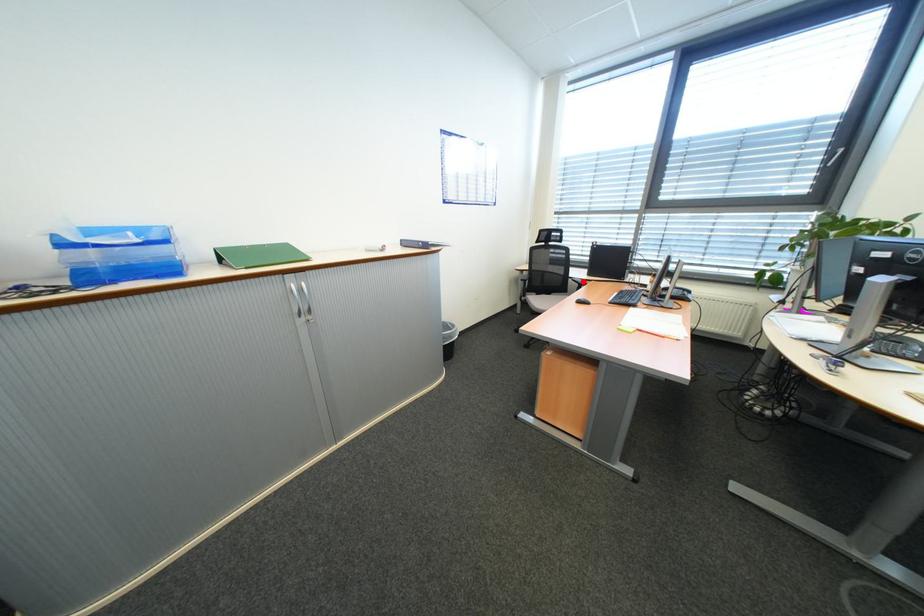
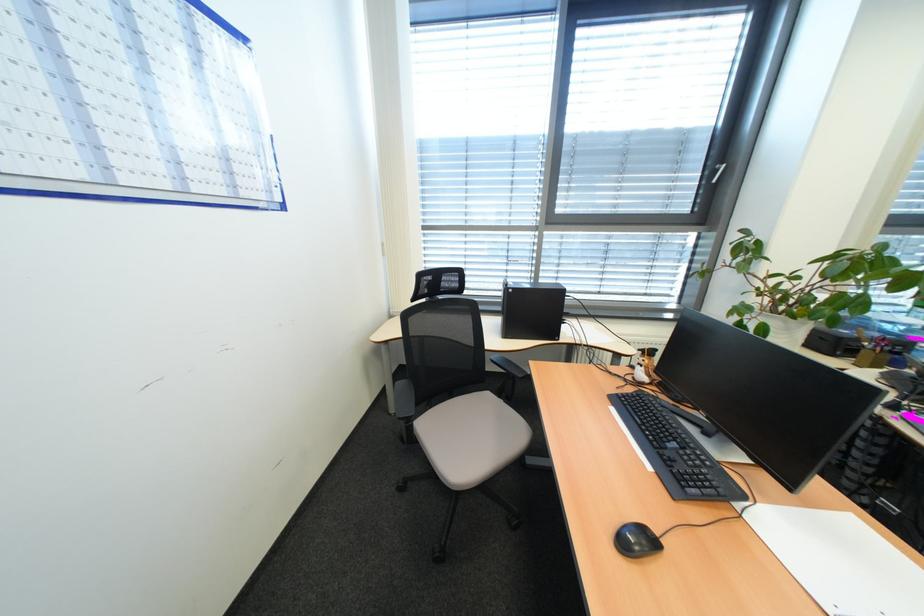
Question: I am providing you with two images of the same scene from different viewpoints. In image1, a red point is highlighted. Considering the same 3D point in image2, which of the following is correct?

Choices:
 (A) It is closer
 (B) It is farther

Answer: (B)